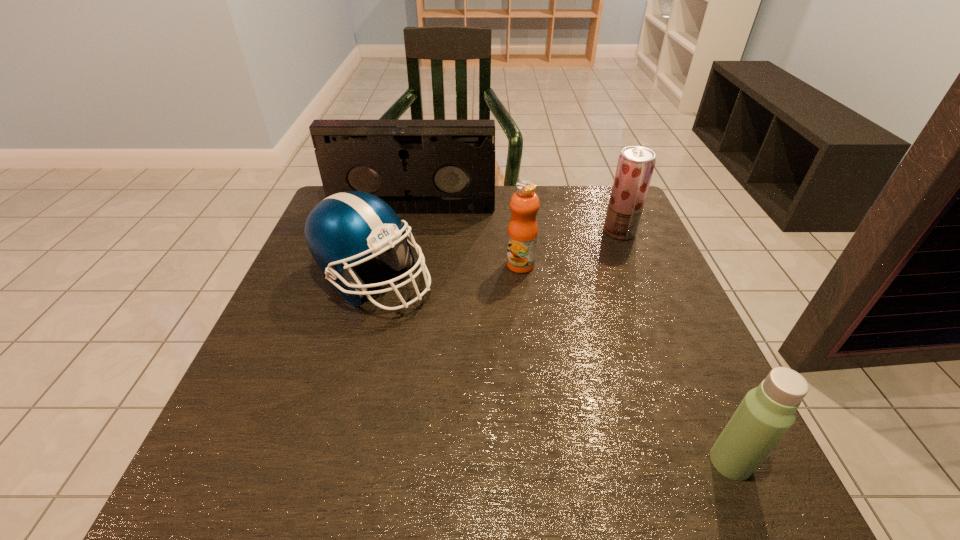
Image resolution: width=960 pixels, height=540 pixels. What are the coordinates of `object at the far right corner` in the screenshot? It's located at (635, 166).

Identify the location of object that is at the near right corner. (767, 412).

Where is `blank space at the far edge`? The image size is (960, 540). blank space at the far edge is located at coordinates (539, 221).

Where is `vacant region at the near edge`? This screenshot has height=540, width=960. vacant region at the near edge is located at coordinates (659, 494).

In the image, there is a desktop. At what (x,y) coordinates should I click in order to perform the action: click on free space at the left edge. Please return your answer as a coordinate pair (x, y). Looking at the image, I should click on (293, 432).

Image resolution: width=960 pixels, height=540 pixels. What are the coordinates of `vacant space at the right edge of the desktop` in the screenshot? It's located at (636, 251).

Locate an element on the screen. free space between the nearer fruit juice and the football helmet is located at coordinates (447, 273).

The width and height of the screenshot is (960, 540). In order to click on free space between the thermos bottle and the nearer fruit juice in this screenshot , I will do `click(626, 363)`.

Identify the location of blank region between the football helmet and the nearer fruit juice. (447, 273).

I want to click on unoccupied position between the football helmet and the right fruit juice, so click(496, 256).